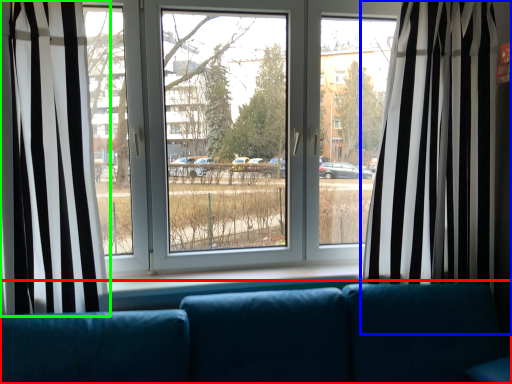
Question: Which object is the farthest from studio couch (highlighted by a red box)? Choose among these: curtain (highlighted by a blue box) or curtain (highlighted by a green box).

Choices:
 (A) curtain
 (B) curtain

Answer: (B)